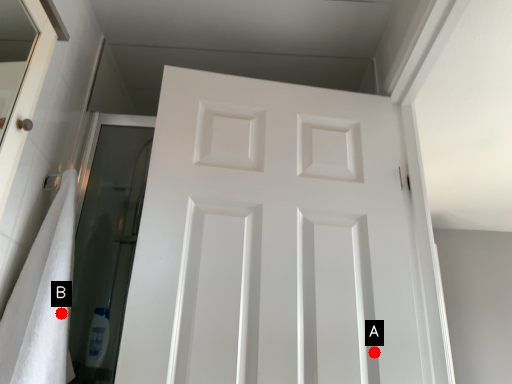
Question: Two points are circled on the image, labeled by A and B beside each circle. Among these points, which one is farthest from the camera?

Choices:
 (A) A is further
 (B) B is further

Answer: (A)